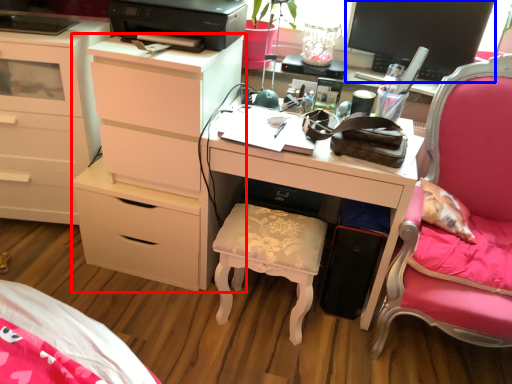
Question: Which of the following is the closest to the observer, chest of drawers (highlighted by a red box) or computer monitor (highlighted by a blue box)?

Choices:
 (A) chest of drawers
 (B) computer monitor

Answer: (B)